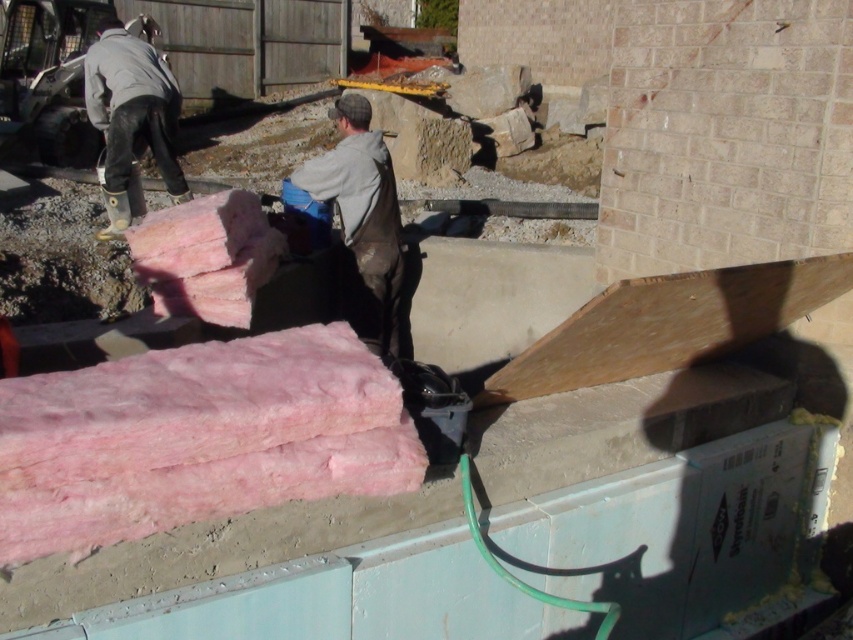
Question: Among these objects, which one is nearest to the camera?

Choices:
 (A) gray matte jacket at center
 (B) gray matte jacket at upper left
 (C) pink fiberglass insulation at lower left

Answer: (C)

Question: Is pink fiberglass insulation at lower left to the left of gray matte jacket at upper left from the viewer's perspective?

Choices:
 (A) no
 (B) yes

Answer: (A)

Question: Which of the following is the closest to the observer?

Choices:
 (A) (396, 236)
 (B) (109, 188)
 (C) (445, 588)

Answer: (C)

Question: Is gray matte jacket at center smaller than gray matte jacket at upper left?

Choices:
 (A) no
 (B) yes

Answer: (B)

Question: Does pink fiberglass insulation at lower left lie behind gray matte jacket at upper left?

Choices:
 (A) yes
 (B) no

Answer: (B)

Question: Which of the following is the closest to the observer?

Choices:
 (A) gray matte jacket at center
 (B) pink fiberglass insulation at lower left
 (C) gray matte jacket at upper left

Answer: (B)